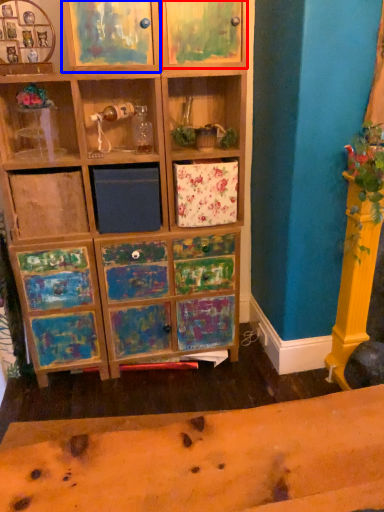
Question: Which object is closer to the camera taking this photo, cabinet (highlighted by a red box) or cabinet (highlighted by a blue box)?

Choices:
 (A) cabinet
 (B) cabinet

Answer: (B)